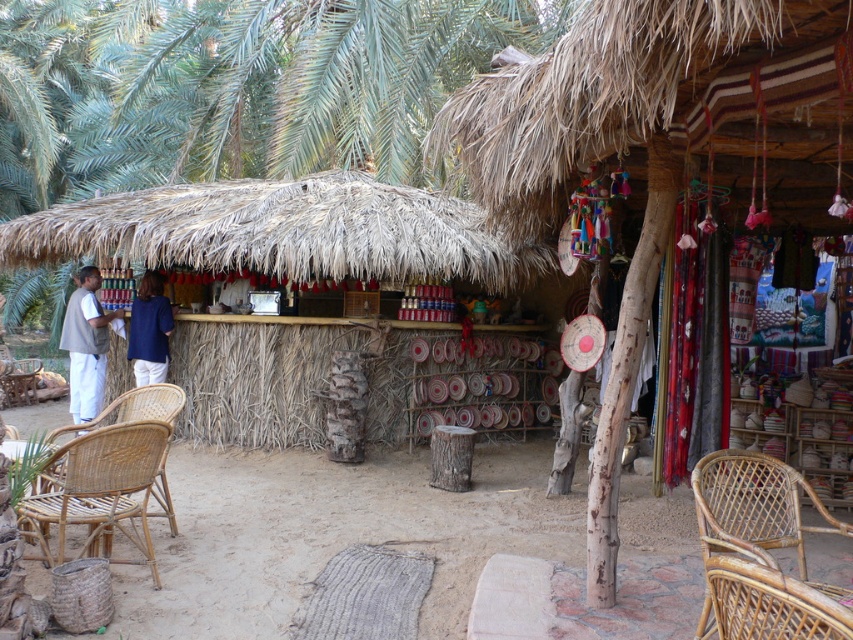
Question: Is brown wicker chair at lower right closer to the viewer compared to natural wicker chair at lower left?

Choices:
 (A) yes
 (B) no

Answer: (A)

Question: In this image, where is thatched straw hut at center located relative to natural wicker chair at lower left?

Choices:
 (A) below
 (B) above

Answer: (B)

Question: Considering the real-world distances, which object is closest to the natural wicker chair at lower left?

Choices:
 (A) blue fabric shirt at center
 (B) brown wicker chair at lower right
 (C) thatched straw hut at center

Answer: (A)

Question: Which point appears closest to the camera in this image?

Choices:
 (A) (68, 340)
 (B) (282, 212)
 (C) (155, 273)

Answer: (B)

Question: Can you confirm if thatched straw hut at center is positioned to the right of rattan chair at lower right?

Choices:
 (A) no
 (B) yes

Answer: (A)

Question: Which point is closer to the camera?

Choices:
 (A) light brown fabric vest at left
 (B) blue fabric shirt at center
 (C) rattan chair at lower right

Answer: (C)